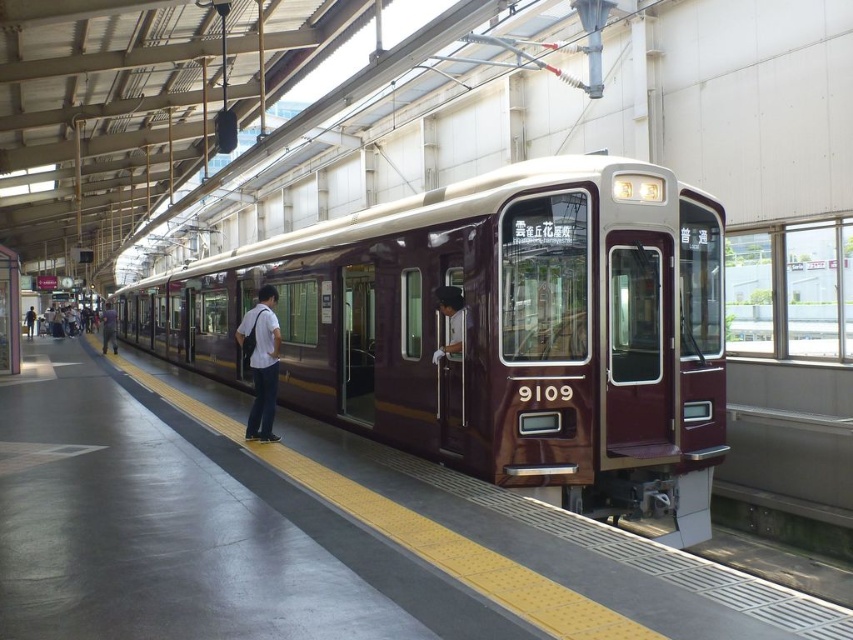
You are standing at point (453, 305) and want to walk to the train doors. There is a point (534, 170) in your path. Is this point in front of you or behind you?

The point (534, 170) is in front of point (453, 305), so it is in front of you.

You are standing at the entrance of the train station platform. You see a shiny maroon train at center. Where exactly is the shiny maroon train located on the platform? Please provide the coordinates in the format of point followed by coordinates like point (x=496, y=330).

The shiny maroon train at center is located at point (x=496, y=330).

You are standing at point (x=410, y=266) on the platform and want to take a photo of the maroon train 9109. If your camera can focus on objects up to 10 meters away, will you be able to capture a clear photo of the train?

The distance between point (x=410, y=266) and the camera is 8.48 meters, which is within the camera focus range of 10 meters. Therefore, you can capture a clear photo of the maroon train 9109.